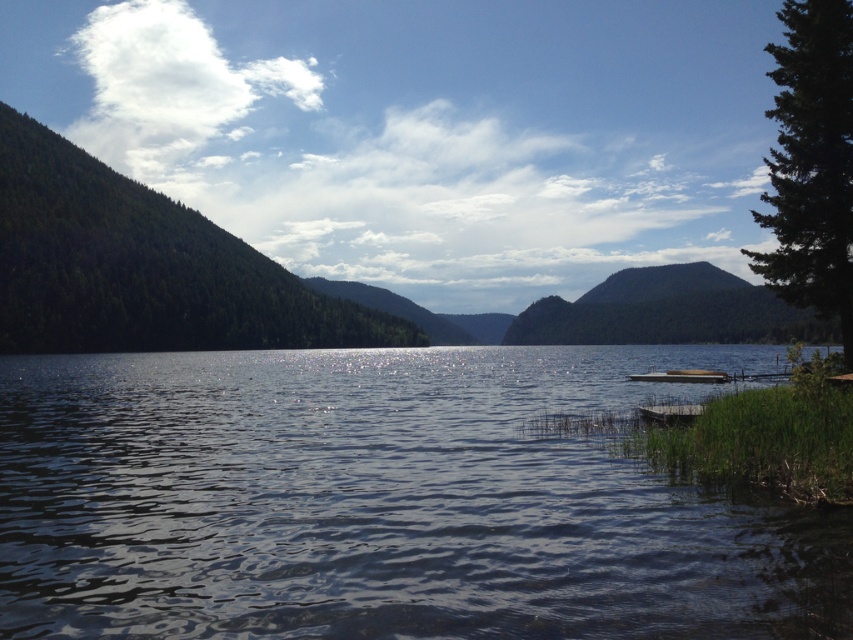
You are standing at the edge of the forest and want to reach the dock. The green textured forest at left is behind you. Which direction should you walk to get to the glistening water at center first?

You should walk towards the right because the glistening water at center is to the right of the green textured forest at left, so moving in that direction will lead you directly towards it.

You are standing on the wooden dock at lower right and want to reach the green textured pine tree at right. Which direction should you move to get closer to the tree?

To reach the green textured pine tree at right from the wooden dock at lower right, you should move upward since the green textured pine tree at right is located above the wooden dock at lower right.